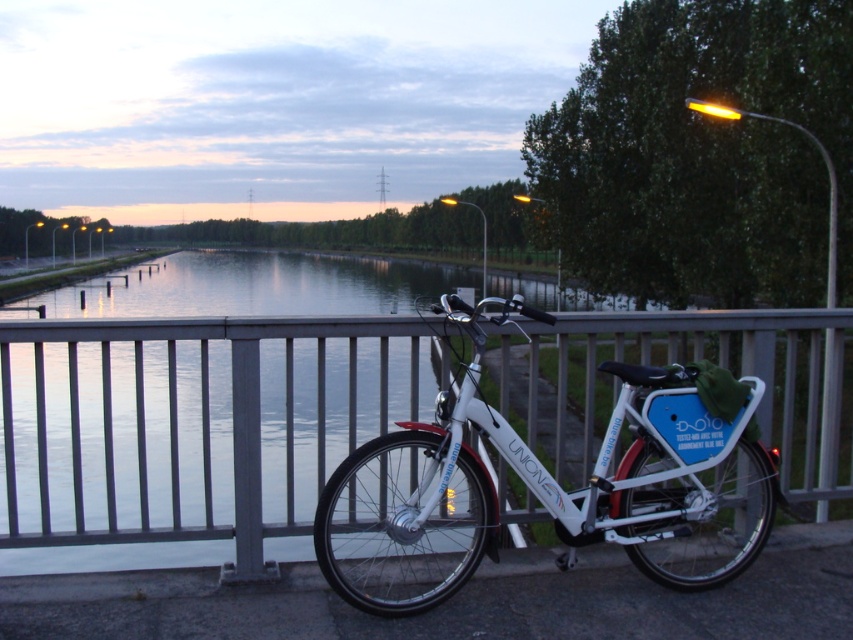
You are standing at the point marked as point (x=848, y=470). You want to cross the canal to the other side. The canal is 14.18 meters wide at this point. Can you safely cross it if you have a 15 meter long plank?

The canal is 14.18 meters wide at this point, so a 15 meter long plank would be sufficient to safely cross it.

You are a delivery person who needs to secure a package between the metallic silver fence at center and the white matte bicycle at center. Which object should you place the package closer to if you want it to be more visible to someone approaching from the front?

The metallic silver fence at center is larger in size than the white matte bicycle at center, so placing the package closer to the metallic silver fence at center would make it more visible to someone approaching from the front.